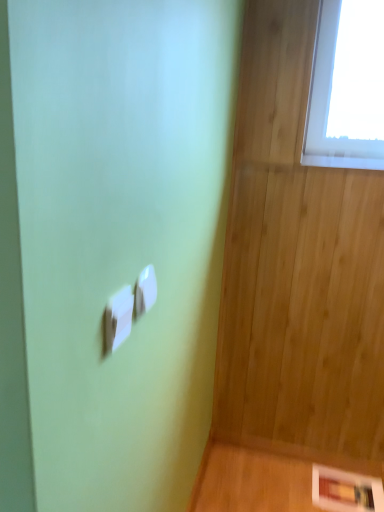
The width and height of the screenshot is (384, 512). In order to click on white plastic light switch at center, which appears as the second light switch when viewed from the left in this screenshot , I will do `click(145, 291)`.

How much space does white plastic light switch at center, the 2th light switch positioned from the back, occupy vertically?

white plastic light switch at center, the 2th light switch positioned from the back, is 3.39 inches tall.

In order to face white glossy picture frame at lower right, should I rotate leftwards or rightwards?

It's best to rotate right around 20.004 degrees.

You are a GUI agent. You are given a task and a screenshot of the screen. Output one action in this format:
    pyautogui.click(x=<x>, y=<y>)
    Task: Click on the white plastic light switch at center, which ranks as the 1th light switch in right-to-left order
    This screenshot has height=512, width=384.
    Given the screenshot: What is the action you would take?
    pyautogui.click(x=145, y=291)

Is there a large distance between white plastic light switch at center, which ranks as the 1th light switch in right-to-left order, and white glossy picture frame at lower right?

Yes, white plastic light switch at center, which ranks as the 1th light switch in right-to-left order, is far from white glossy picture frame at lower right.

Considering the sizes of objects white plastic light switch at center, which is the 2th light switch from front to back, and white glossy picture frame at lower right in the image provided, who is thinner, white plastic light switch at center, which is the 2th light switch from front to back, or white glossy picture frame at lower right?

white plastic light switch at center, which is the 2th light switch from front to back, is thinner.

Considering the positions of objects white plastic light switch at center, which appears as the second light switch when viewed from the left, and white glossy picture frame at lower right in the image provided, who is behind, white plastic light switch at center, which appears as the second light switch when viewed from the left, or white glossy picture frame at lower right?

white glossy picture frame at lower right.

Which object is thinner, white glossy picture frame at lower right or white plastic light switch at center, which appears as the second light switch when viewed from the left?

white plastic light switch at center, which appears as the second light switch when viewed from the left.

In terms of height, does white glossy picture frame at lower right look taller or shorter compared to white plastic light switch at center, which appears as the second light switch when viewed from the left?

Clearly, white glossy picture frame at lower right is shorter compared to white plastic light switch at center, which appears as the second light switch when viewed from the left.

From a real-world perspective, between white glossy picture frame at lower right and white plastic light switch at center, which is the 2th light switch from front to back, who is vertically higher?

white plastic light switch at center, which is the 2th light switch from front to back.

Is white plastic light switch at center, the 1th light switch when ordered from left to right, oriented towards white glossy picture frame at lower right?

No, white plastic light switch at center, the 1th light switch when ordered from left to right, is not aimed at white glossy picture frame at lower right.

From the image's perspective, between white plastic light switch at center, the second light switch when ordered from right to left, and white glossy picture frame at lower right, who is located below?

white glossy picture frame at lower right, from the image's perspective.

Consider the image. From a real-world perspective, is white plastic light switch at center, the 1th light switch when ordered from left to right, on top of white glossy picture frame at lower right?

Yes, from a real-world perspective, white plastic light switch at center, the 1th light switch when ordered from left to right, is on top of white glossy picture frame at lower right.

Who is shorter, white glossy picture frame at lower right or white plastic light switch at center, the 1th light switch when ordered from left to right?

Standing shorter between the two is white glossy picture frame at lower right.

Does point (342, 480) lie behind point (121, 323)?

Yes, point (342, 480) is farther from viewer.

From the image's perspective, which one is positioned higher, white glossy picture frame at lower right or white plastic light switch at center, the 2th light switch positioned from the back?

white plastic light switch at center, the 2th light switch positioned from the back, is shown above in the image.

How distant is white glossy picture frame at lower right from white plastic light switch at center, the 1th light switch when ordered from left to right?

A distance of 5.39 feet exists between white glossy picture frame at lower right and white plastic light switch at center, the 1th light switch when ordered from left to right.

The height and width of the screenshot is (512, 384). In order to click on light switch above the white plastic light switch at center, the 1th light switch when ordered from left to right (from a real-world perspective) in this screenshot , I will do click(145, 291).

From the image's perspective, is white plastic light switch at center, placed as the 1th light switch when sorted from front to back, positioned above or below white plastic light switch at center, which ranks as the 1th light switch in right-to-left order?

Based on their image positions, white plastic light switch at center, placed as the 1th light switch when sorted from front to back, is located beneath white plastic light switch at center, which ranks as the 1th light switch in right-to-left order.

Looking at this image, considering the relative positions of white plastic light switch at center, the second light switch when ordered from right to left, and white plastic light switch at center, which is counted as the first light switch, starting from the back, in the image provided, is white plastic light switch at center, the second light switch when ordered from right to left, to the left or to the right of white plastic light switch at center, which is counted as the first light switch, starting from the back,?

In the image, white plastic light switch at center, the second light switch when ordered from right to left, appears on the left side of white plastic light switch at center, which is counted as the first light switch, starting from the back.

Between white plastic light switch at center, which is the 2th light switch from front to back, and white plastic light switch at center, the second light switch when ordered from right to left, which one is positioned behind?

Positioned behind is white plastic light switch at center, which is the 2th light switch from front to back.

Is white plastic light switch at center, which appears as the second light switch when viewed from the left, far away from white plastic light switch at center, placed as the 1th light switch when sorted from front to back?

Actually, white plastic light switch at center, which appears as the second light switch when viewed from the left, and white plastic light switch at center, placed as the 1th light switch when sorted from front to back, are a little close together.

What's the angular difference between white plastic light switch at center, which ranks as the 1th light switch in right-to-left order, and white plastic light switch at center, the 1th light switch when ordered from left to right,'s facing directions?

The angle between the facing direction of white plastic light switch at center, which ranks as the 1th light switch in right-to-left order, and the facing direction of white plastic light switch at center, the 1th light switch when ordered from left to right, is 0.0108 degrees.

Is point (143, 281) behind point (128, 291)?

Yes.

The image size is (384, 512). In order to click on panel below the white plastic light switch at center, which is counted as the first light switch, starting from the back (from the image's perspective) in this screenshot , I will do `click(346, 490)`.

Where is `the 1st light switch in front of the white glossy picture frame at lower right`? The height and width of the screenshot is (512, 384). the 1st light switch in front of the white glossy picture frame at lower right is located at coordinates (145, 291).

When comparing their distances from white plastic light switch at center, which appears as the second light switch when viewed from the left, does white glossy picture frame at lower right or white plastic light switch at center, placed as the 1th light switch when sorted from front to back, seem closer?

white plastic light switch at center, placed as the 1th light switch when sorted from front to back.

Considering their positions, is white plastic light switch at center, which appears as the second light switch when viewed from the left, positioned closer to white plastic light switch at center, the second light switch when ordered from right to left, than white glossy picture frame at lower right?

Among the two, white plastic light switch at center, which appears as the second light switch when viewed from the left, is located nearer to white plastic light switch at center, the second light switch when ordered from right to left.

Considering their positions, is white plastic light switch at center, which ranks as the 1th light switch in right-to-left order, positioned closer to white glossy picture frame at lower right than white plastic light switch at center, placed as the 1th light switch when sorted from front to back?

white plastic light switch at center, which ranks as the 1th light switch in right-to-left order, lies closer to white glossy picture frame at lower right than the other object.

When comparing their distances from white plastic light switch at center, placed as the 1th light switch when sorted from front to back, does white glossy picture frame at lower right or white plastic light switch at center, which is the 2th light switch from front to back, seem closer?

white plastic light switch at center, which is the 2th light switch from front to back.

Which object lies nearer to the anchor point white glossy picture frame at lower right, white plastic light switch at center, placed as the 1th light switch when sorted from front to back, or white plastic light switch at center, which appears as the second light switch when viewed from the left?

Among the two, white plastic light switch at center, which appears as the second light switch when viewed from the left, is located nearer to white glossy picture frame at lower right.

When comparing their distances from white plastic light switch at center, which is the 2th light switch from front to back, does white plastic light switch at center, the second light switch when ordered from right to left, or white glossy picture frame at lower right seem closer?

white plastic light switch at center, the second light switch when ordered from right to left, lies closer to white plastic light switch at center, which is the 2th light switch from front to back, than the other object.

Locate an element on the screen. The height and width of the screenshot is (512, 384). light switch between white plastic light switch at center, the 2th light switch positioned from the back, and white glossy picture frame at lower right from front to back is located at coordinates (x=145, y=291).